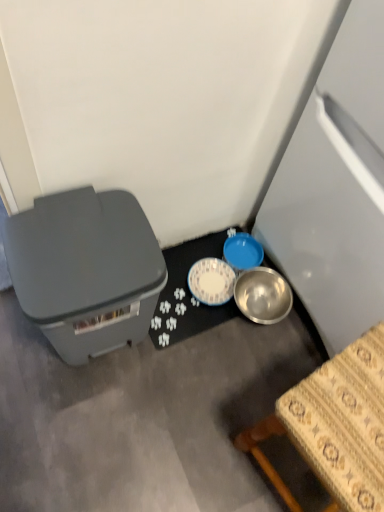
Question: Considering the positions of satin white refrigerator at right and metallic silver bowl at lower center in the image, is satin white refrigerator at right wider or thinner than metallic silver bowl at lower center?

Choices:
 (A) thin
 (B) wide

Answer: (B)

Question: From the image's perspective, relative to metallic silver bowl at lower center, is satin white refrigerator at right above or below?

Choices:
 (A) above
 (B) below

Answer: (A)

Question: Considering the real-world distances, which object is closest to the wooden table at lower right?

Choices:
 (A) blue plastic bowl at center-right
 (B) matte gray storage box at left
 (C) metallic silver bowl at lower center
 (D) satin white refrigerator at right

Answer: (D)

Question: Estimate the real-world distances between objects in this image. Which object is closer to the wooden table at lower right?

Choices:
 (A) metallic silver bowl at lower center
 (B) blue plastic bowl at center-right
 (C) matte gray storage box at left
 (D) satin white refrigerator at right

Answer: (D)